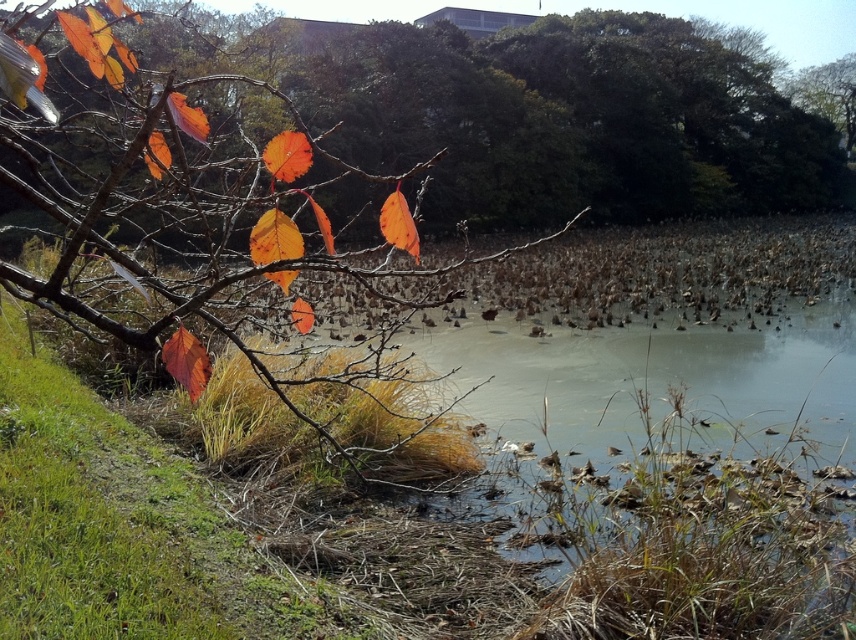
You are an artist sketching the autumn scene. You notice two groups of leaves in the image. Which group, the matte orange leaves at left or the orange matte leaves at upper left, appears smaller in the drawing?

The matte orange leaves at left appears smaller in the drawing because it occupies less space than the orange matte leaves at upper left.